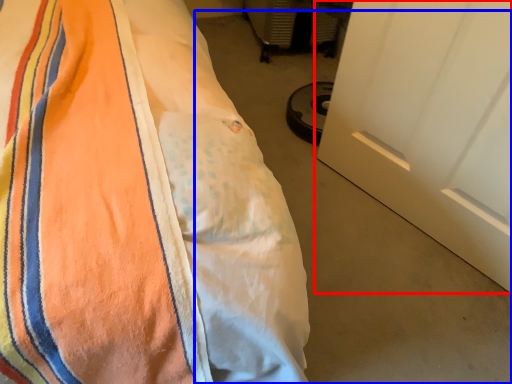
Question: Which of the following is the closest to the observer, door (highlighted by a red box) or concrete (highlighted by a blue box)?

Choices:
 (A) door
 (B) concrete

Answer: (A)